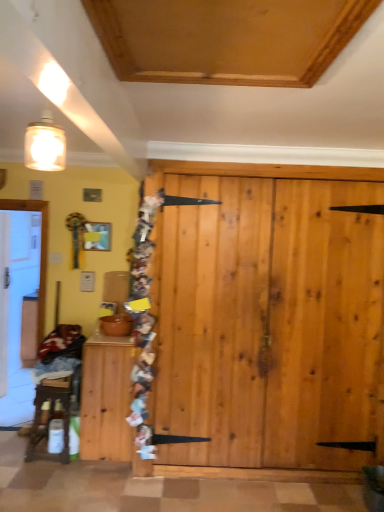
Question: Looking at their shapes, would you say wooden cabinet at lower left is wider or thinner than wooden table at left?

Choices:
 (A) thin
 (B) wide

Answer: (B)

Question: Based on their positions, is wooden cabinet at lower left located to the left or right of wooden table at left?

Choices:
 (A) right
 (B) left

Answer: (A)

Question: From a real-world perspective, is wooden cabinet at lower left physically located above or below wooden table at left?

Choices:
 (A) above
 (B) below

Answer: (A)

Question: In the image, is wooden table at left on the left side or the right side of wooden cabinet at lower left?

Choices:
 (A) left
 (B) right

Answer: (A)

Question: From their relative heights in the image, would you say wooden table at left is taller or shorter than wooden cabinet at lower left?

Choices:
 (A) short
 (B) tall

Answer: (A)

Question: From a real-world perspective, is wooden table at left positioned above or below wooden cabinet at lower left?

Choices:
 (A) below
 (B) above

Answer: (A)

Question: Do you think wooden table at left is within wooden cabinet at lower left, or outside of it?

Choices:
 (A) inside
 (B) outside

Answer: (B)